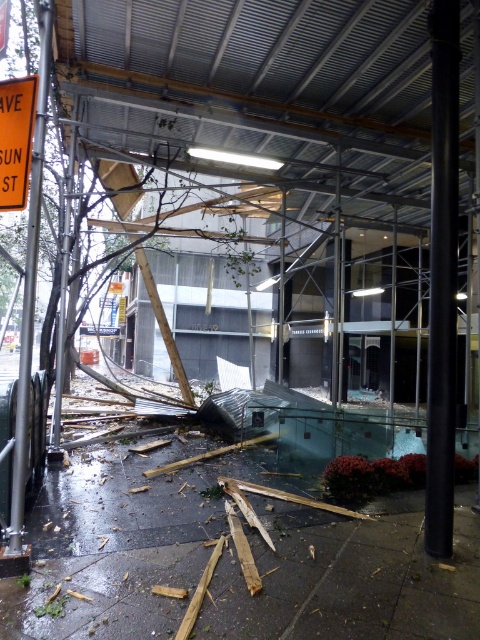
You are a rescue worker assessing the scene. You notice the wet concrete pavement at lower center and the black metal pole at right. Which object is shorter in height?

The wet concrete pavement at lower center has a lesser height compared to the black metal pole at right, so the wet concrete pavement at lower center is shorter.

You are a rescue worker trying to reach the entrance of the building. You see the wet concrete pavement at lower center. Where exactly is the wet concrete pavement located in relation to the building entrance?

The wet concrete pavement at lower center is located at point coordinates (121, 540) relative to the building entrance.